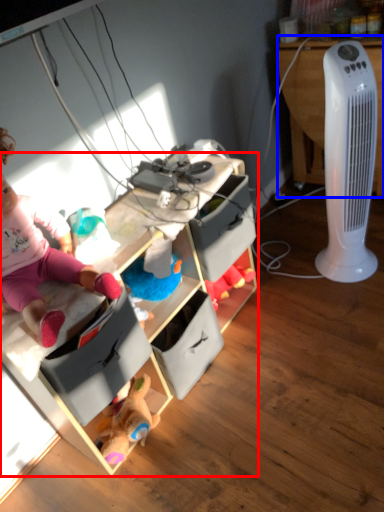
Question: Among these objects, which one is farthest to the camera, cabinetry (highlighted by a red box) or desk (highlighted by a blue box)?

Choices:
 (A) cabinetry
 (B) desk

Answer: (B)